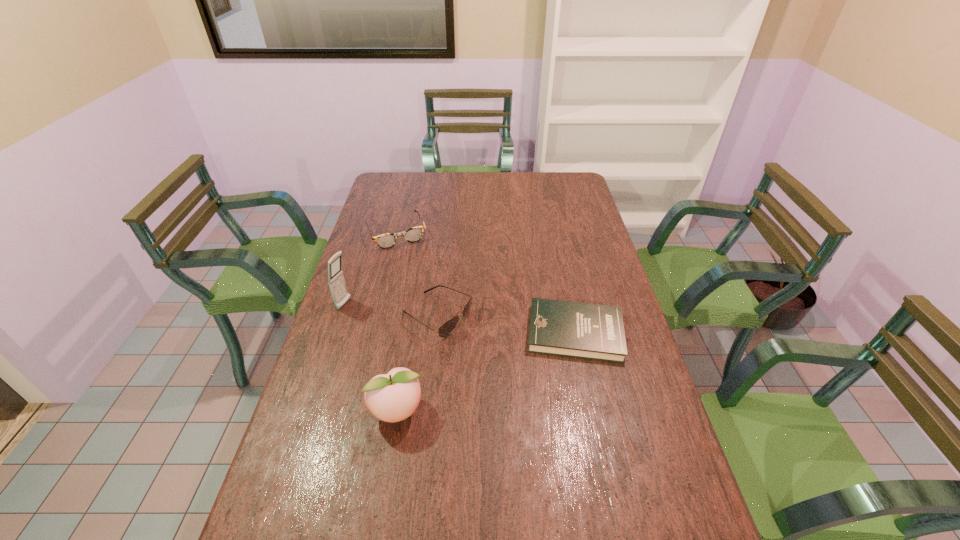
Locate an element on the screen. vacant point located between the book and the sunglasses is located at coordinates (506, 325).

Identify the location of blank region between the rightmost object and the tallest object. This screenshot has width=960, height=540. (460, 319).

This screenshot has width=960, height=540. Find the location of `vacant area between the shortest object and the sunglasses`. vacant area between the shortest object and the sunglasses is located at coordinates (506, 325).

You are a GUI agent. You are given a task and a screenshot of the screen. Output one action in this format:
    pyautogui.click(x=<x>, y=<y>)
    Task: Click on the vacant region between the tallest object and the second tallest object
    Image resolution: width=960 pixels, height=540 pixels.
    Given the screenshot: What is the action you would take?
    click(x=371, y=358)

Locate an element on the screen. free space between the fourth shortest object and the cellular telephone is located at coordinates (371, 358).

Image resolution: width=960 pixels, height=540 pixels. In order to click on vacant region between the fourth shortest object and the rightmost object in this screenshot , I will do `click(486, 372)`.

Identify the location of vacant point located between the nearest object and the farthest object. (396, 322).

This screenshot has height=540, width=960. In order to click on object that is the third closest one to the nearest object in this screenshot , I will do `click(336, 281)`.

Select which object is the second closest to the tallest object. Please provide its 2D coordinates. Your answer should be formatted as a tuple, i.e. [(x, y)], where the tuple contains the x and y coordinates of a point satisfying the conditions above.

[(414, 234)]

This screenshot has height=540, width=960. I want to click on free region that satisfies the following two spatial constraints: 1. on the back side of the peach; 2. on the left side of the sunglasses, so click(412, 316).